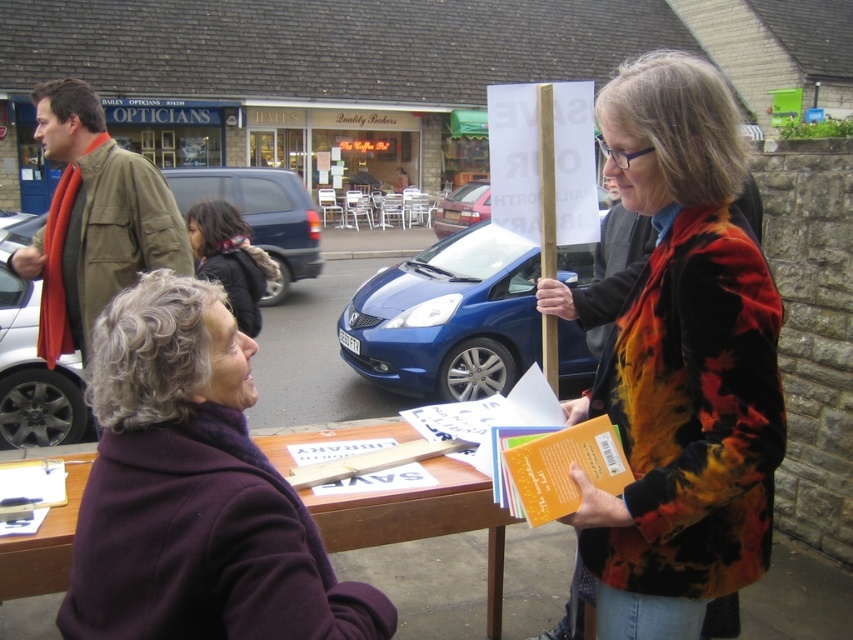
Does metallic silver car at left have a greater height compared to blue metallic van at center-left?

Incorrect, metallic silver car at left's height is not larger of blue metallic van at center-left's.

Which is more to the left, metallic silver car at left or blue metallic van at center-left?

blue metallic van at center-left

Between point (51, 416) and point (296, 262), which one is positioned in front?

Point (51, 416)

You are a GUI agent. You are given a task and a screenshot of the screen. Output one action in this format:
    pyautogui.click(x=<x>, y=<y>)
    Task: Click on the metallic silver car at left
    The height and width of the screenshot is (640, 853).
    Given the screenshot: What is the action you would take?
    pyautogui.click(x=33, y=369)

Does purple woolen coat at center have a lesser width compared to metallic silver car at left?

Correct, purple woolen coat at center's width is less than metallic silver car at left's.

Does purple woolen coat at center appear under metallic silver car at left?

Yes.

Identify the location of purple woolen coat at center. This screenshot has width=853, height=640. (194, 492).

Is blue metallic car at center smaller than olive-green jacket at left?

Incorrect, blue metallic car at center is not smaller in size than olive-green jacket at left.

Does blue metallic car at center lie behind olive-green jacket at left?

Yes, blue metallic car at center is further from the viewer.

Where is `blue metallic car at center`? This screenshot has height=640, width=853. blue metallic car at center is located at coordinates (447, 317).

Identify the location of blue metallic car at center. (447, 317).